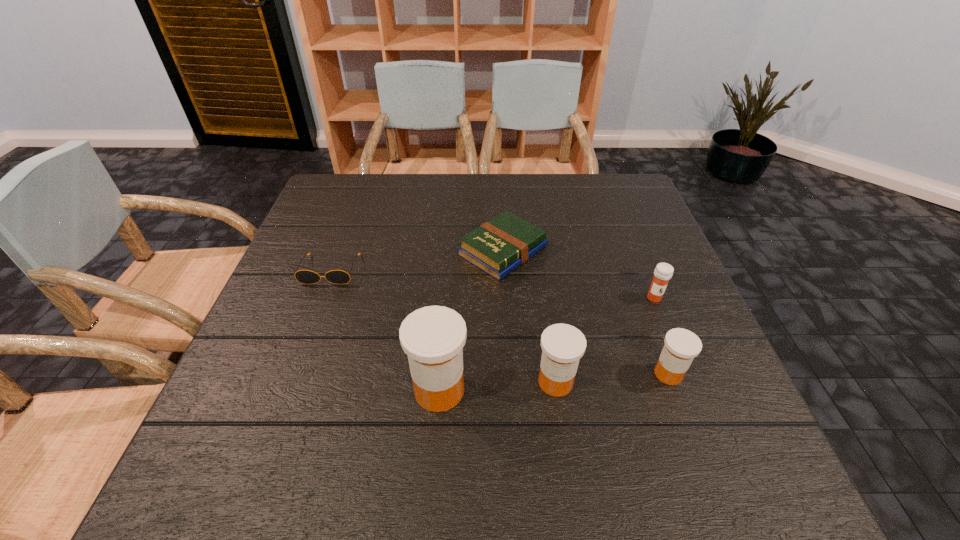
What are the coordinates of `vacant point located on the label side of the farthest medicine` in the screenshot? It's located at (698, 406).

I want to click on object that is at the left edge, so click(303, 276).

I want to click on vacant space at the far edge of the desktop, so click(450, 199).

In the image, there is a desktop. At what (x,y) coordinates should I click in order to perform the action: click on vacant space at the near edge. Please return your answer as a coordinate pair (x, y). This screenshot has height=540, width=960. Looking at the image, I should click on (316, 413).

Identify the location of vacant point at the left edge. This screenshot has width=960, height=540. (308, 362).

Where is `blank area at the far left corner`? This screenshot has height=540, width=960. blank area at the far left corner is located at coordinates (362, 204).

In order to click on vacant area at the near left corner in this screenshot , I will do `click(284, 399)`.

You are a GUI agent. You are given a task and a screenshot of the screen. Output one action in this format:
    pyautogui.click(x=<x>, y=<y>)
    Task: Click on the free region at the near right corner of the desktop
    This screenshot has height=540, width=960.
    Given the screenshot: What is the action you would take?
    pyautogui.click(x=701, y=388)

Locate an element on the screen. This screenshot has width=960, height=540. free space between the book and the leftmost medicine is located at coordinates point(471,320).

Identify the location of vacant space in between the farthest medicine and the leftmost object. (492, 284).